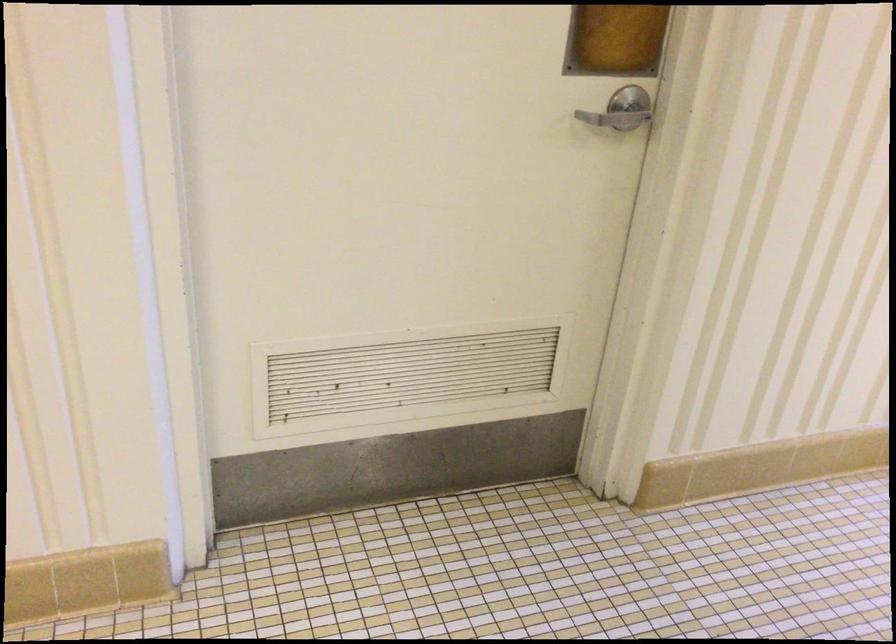
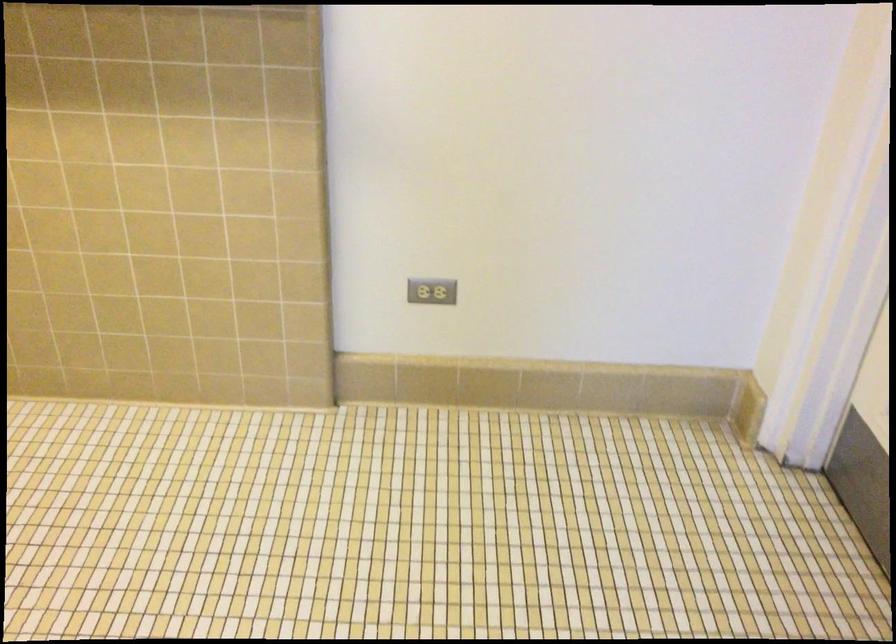
Looking at this image, how did the camera likely rotate?

The camera's rotation is toward left-down.